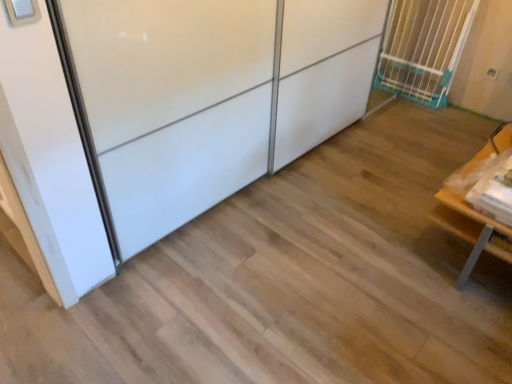
Question: Visually, is white glossy sliding door at upper left positioned to the left or to the right of wooden table at right?

Choices:
 (A) right
 (B) left

Answer: (B)

Question: In terms of width, does white glossy sliding door at upper left look wider or thinner when compared to wooden table at right?

Choices:
 (A) wide
 (B) thin

Answer: (B)

Question: Which of these objects is positioned farthest from the wooden table at right?

Choices:
 (A) white plastic gate at upper right
 (B) white glossy sliding door at upper left

Answer: (A)

Question: Which is farther from the wooden table at right?

Choices:
 (A) white glossy sliding door at upper left
 (B) white plastic gate at upper right

Answer: (B)